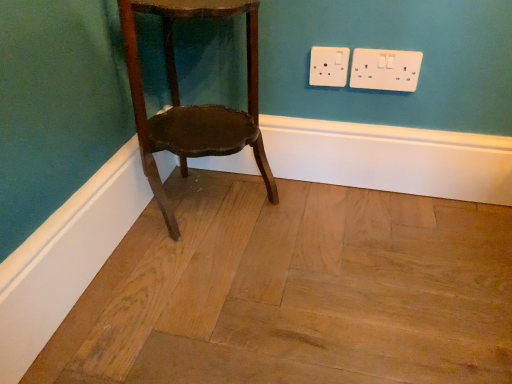
In order to face dark brown wood chair at lower left, should I rotate leftwards or rightwards?

Turn left approximately 4.167 degrees to face it.

Image resolution: width=512 pixels, height=384 pixels. Describe the element at coordinates (193, 105) in the screenshot. I see `dark brown wood chair at lower left` at that location.

Measure the distance between dark brown wood chair at lower left and camera.

27.24 inches.

The image size is (512, 384). I want to click on dark brown wood chair at lower left, so click(193, 105).

Find the location of a particular element. This screenshot has width=512, height=384. dark brown wood chair at lower left is located at coordinates (193, 105).